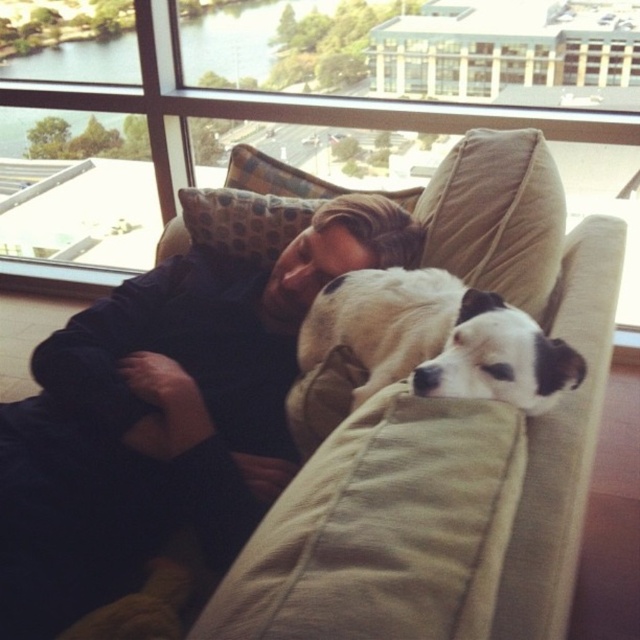
Who is taller, beige fabric couch at center or black soft shirt at center?

With more height is beige fabric couch at center.

Can you confirm if beige fabric couch at center is positioned below black soft shirt at center?

Yes, beige fabric couch at center is below black soft shirt at center.

Describe the element at coordinates (445, 445) in the screenshot. I see `beige fabric couch at center` at that location.

This screenshot has height=640, width=640. I want to click on beige fabric couch at center, so click(x=445, y=445).

Which is above, transparent glass window at upper center or white-furred dog at center?

Positioned higher is transparent glass window at upper center.

Consider the image. Does transparent glass window at upper center come in front of white-furred dog at center?

No, transparent glass window at upper center is behind white-furred dog at center.

What do you see at coordinates (320, 116) in the screenshot? I see `transparent glass window at upper center` at bounding box center [320, 116].

At what (x,y) coordinates should I click in order to perform the action: click on transparent glass window at upper center. Please return your answer as a coordinate pair (x, y). The height and width of the screenshot is (640, 640). Looking at the image, I should click on (320, 116).

Can you confirm if transparent glass window at upper center is positioned to the right of black soft shirt at center?

Yes, transparent glass window at upper center is to the right of black soft shirt at center.

Where is `transparent glass window at upper center`? transparent glass window at upper center is located at coordinates (320, 116).